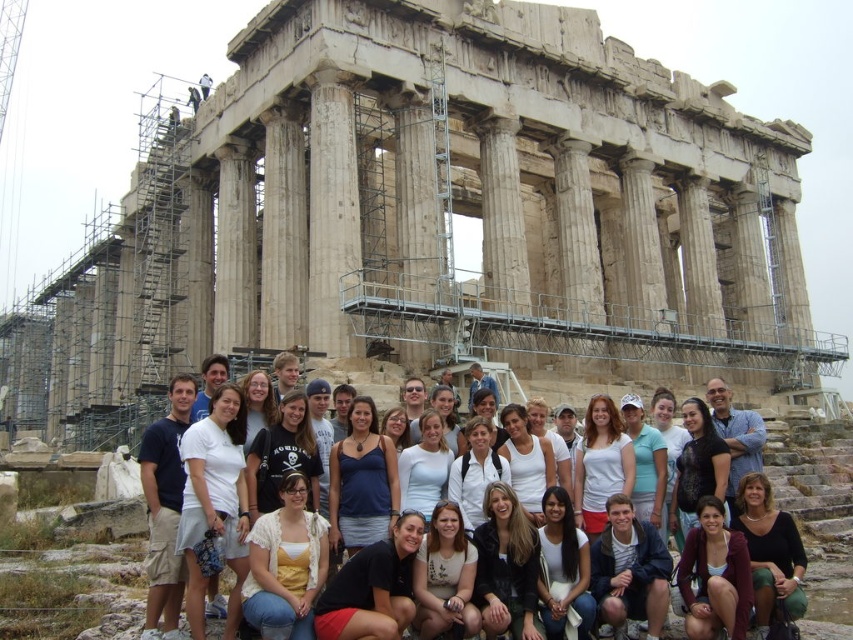
Question: Which object is closer to the camera taking this photo?

Choices:
 (A) stone columns at center
 (B) white cotton shirt at center

Answer: (B)

Question: Is stone columns at center below white cotton shirt at center?

Choices:
 (A) yes
 (B) no

Answer: (B)

Question: Is stone columns at center to the left of white cotton shirt at center from the viewer's perspective?

Choices:
 (A) no
 (B) yes

Answer: (B)

Question: Is stone columns at center positioned before white cotton shirt at center?

Choices:
 (A) no
 (B) yes

Answer: (A)

Question: Which object appears farthest from the camera in this image?

Choices:
 (A) stone columns at center
 (B) white cotton shirt at center

Answer: (A)